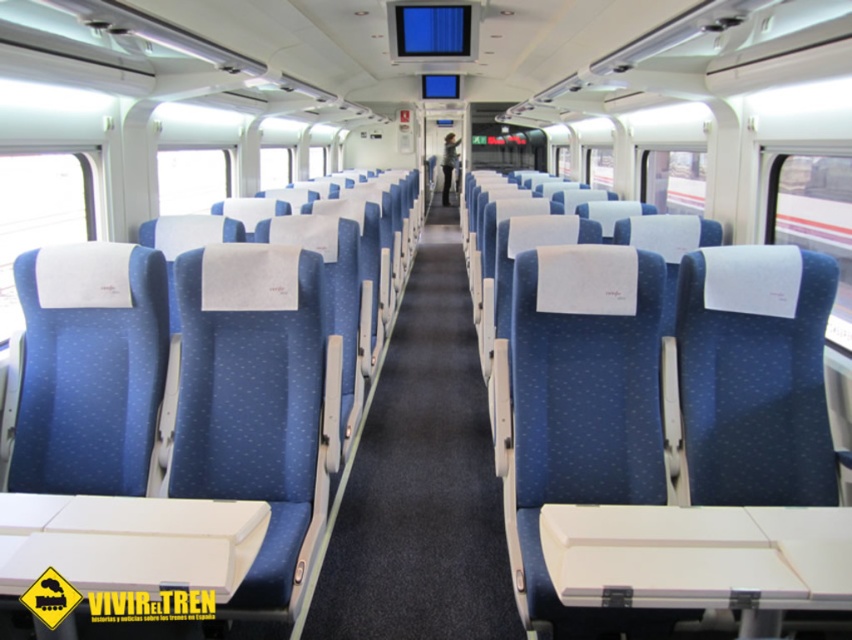
You are standing in the train carriage and need to locate the blue fabric aisle at center. According to the coordinates provided, where would you find it?

The blue fabric aisle at center is located at point (421, 481).

You are a passenger standing at the entrance of the train carriage. You need to reach the blue fabric coach at center. Which direction should you move relative to the blue fabric aisle at center?

The blue fabric aisle at center is closer to you than the blue fabric coach at center. To reach the blue fabric coach at center, you should move away from the blue fabric aisle at center.